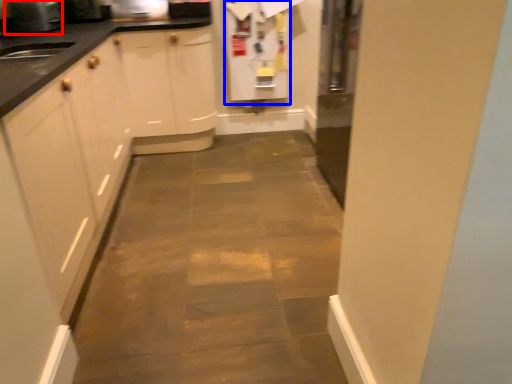
Question: Which point is closer to the camera, appliance (highlighted by a red box) or appliance (highlighted by a blue box)?

Choices:
 (A) appliance
 (B) appliance

Answer: (A)